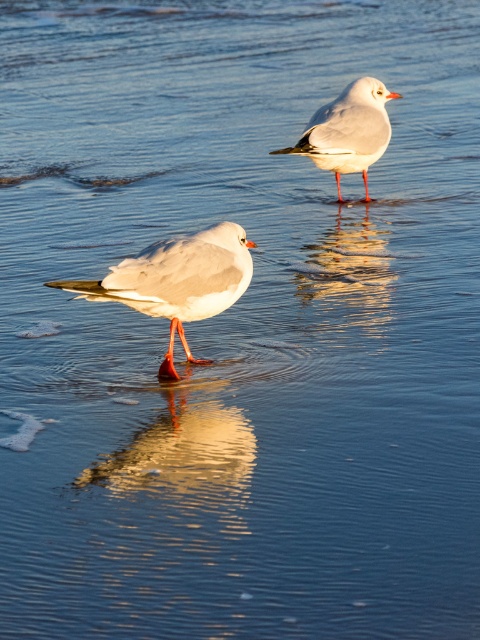
You are a photographer trying to capture the reflection of the white matte seagull at center in the water. Based on the scene, where should you position your camera to ensure the reflection is fully visible in the frame?

To capture the reflection of the white matte seagull at center, position your camera at the same height as the water surface and directly above the point where the seagull is standing, which is at 0.439 on the x and 0.371 on the y coordinates. This ensures the reflection aligns perfectly with the seagull, making it fully visible in the frame.

You are observing two birds in the water. Based on their positions, which one is closer to you, the white matte seagull at center or the white matte bird at upper center?

The white matte seagull at center is closer to you because it has a lesser height compared to the white matte bird at upper center, which means it is positioned closer in the scene.